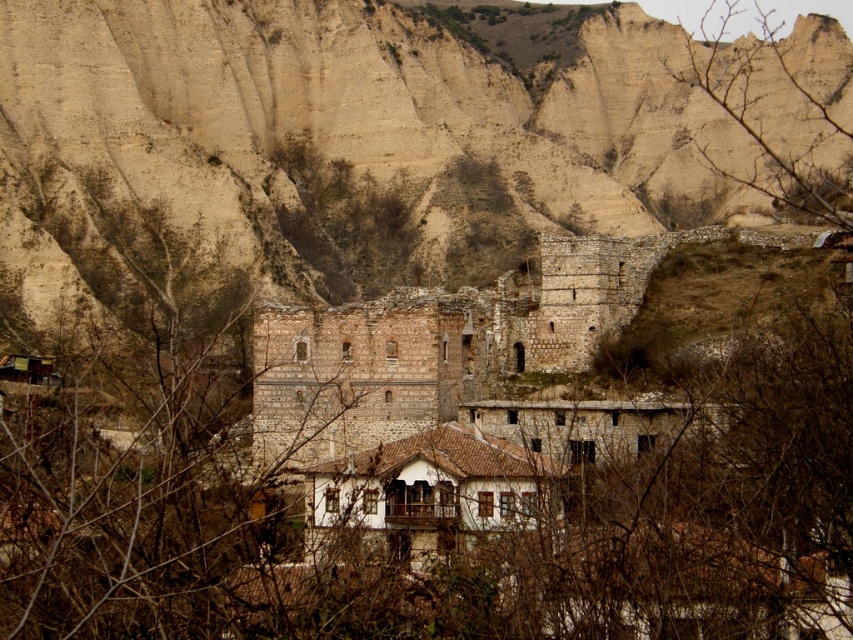
Does beige stone wall at center come in front of bare branches at upper right?

No.

Who is higher up, beige stone wall at center or bare branches at upper right?

Positioned higher is bare branches at upper right.

Is point (599, 52) farther from viewer compared to point (770, 48)?

Yes, it is behind point (770, 48).

Locate an element on the screen. This screenshot has height=640, width=853. beige stone wall at center is located at coordinates (344, 138).